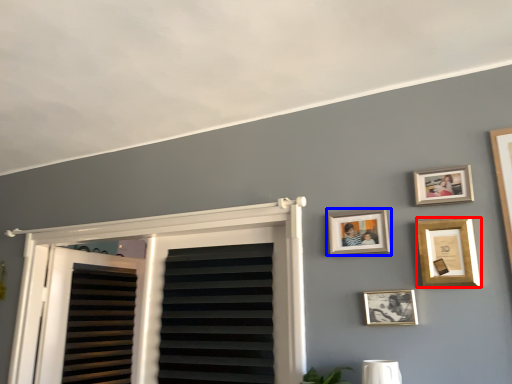
Question: Which point is closer to the camera, picture frame (highlighted by a red box) or picture frame (highlighted by a blue box)?

Choices:
 (A) picture frame
 (B) picture frame

Answer: (A)